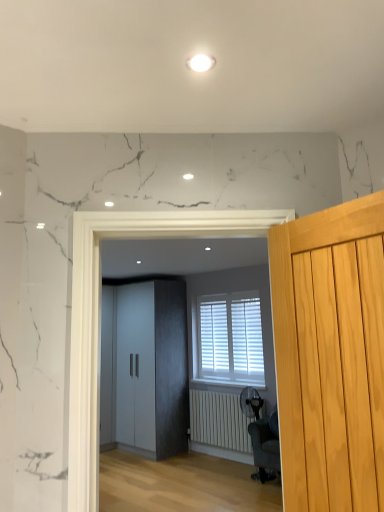
Question: In the image, is matte gray wardrobe at center on the left side or the right side of dark gray fabric swivel chair at center?

Choices:
 (A) right
 (B) left

Answer: (B)

Question: Is matte gray wardrobe at center inside or outside of dark gray fabric swivel chair at center?

Choices:
 (A) inside
 (B) outside

Answer: (B)

Question: Considering the real-world distances, which object is closest to the white matte radiator at lower center?

Choices:
 (A) white matte cabinet at center
 (B) light wood door at right
 (C) dark gray fabric swivel chair at center
 (D) white matte blinds at center
 (E) matte gray wardrobe at center

Answer: (C)

Question: Considering the real-world distances, which object is farthest from the white matte cabinet at center?

Choices:
 (A) light wood door at right
 (B) matte gray wardrobe at center
 (C) white matte radiator at lower center
 (D) dark gray fabric swivel chair at center
 (E) white matte blinds at center

Answer: (A)